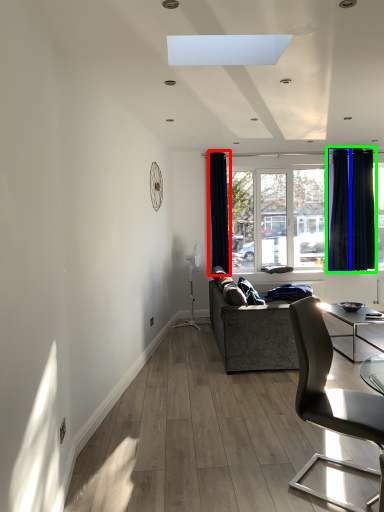
Question: Which object is the closest to the curtain (highlighted by a red box)? Choose among these: curtain (highlighted by a blue box) or curtain (highlighted by a green box).

Choices:
 (A) curtain
 (B) curtain

Answer: (A)